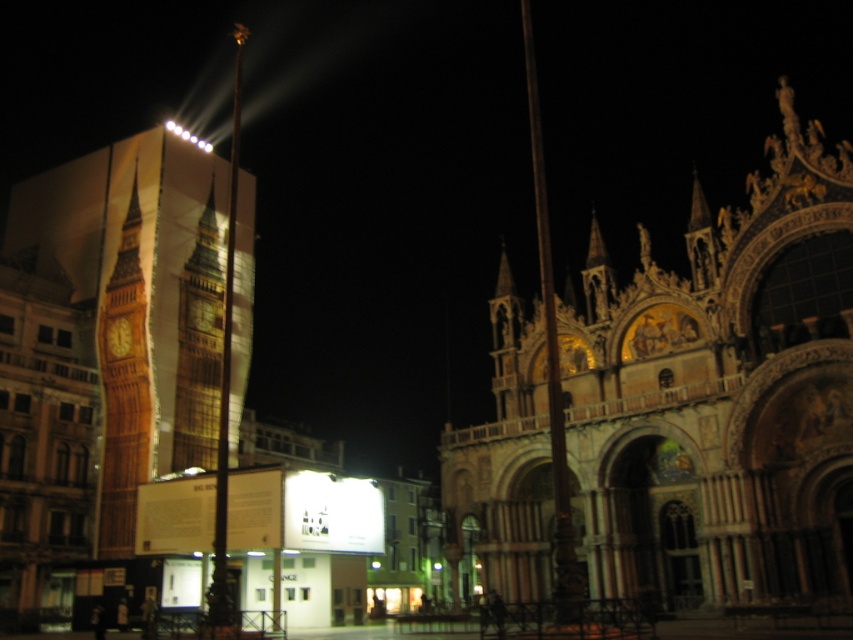
You are an architect analyzing the proportions of the buildings in the image. Which object has a greater width between the golden stone church at left and the shiny metallic flag pole at center?

The golden stone church at left has a greater width than the shiny metallic flag pole at center.

In the scene shown: You are standing in the middle of the street looking at the golden mosaic church at center and the wooden big ben at left. Which building is closer to you?

The golden mosaic church at center is closer to the viewer than the wooden big ben at left.

You are standing at the point marked as point (57, 376) in the image. You want to take a photo of the large modern building with the Big Ben advertisement on the left. Is the modern building visible in your current field of view?

The distance of point (57, 376) from camera is 81.58 meters. Since the modern building with the Big Ben advertisement is on the left side of the image, and you are at point (57, 376) which is 81.58 meters away from the camera, the modern building should be visible in your current field of view as it is positioned to the left of your current position.